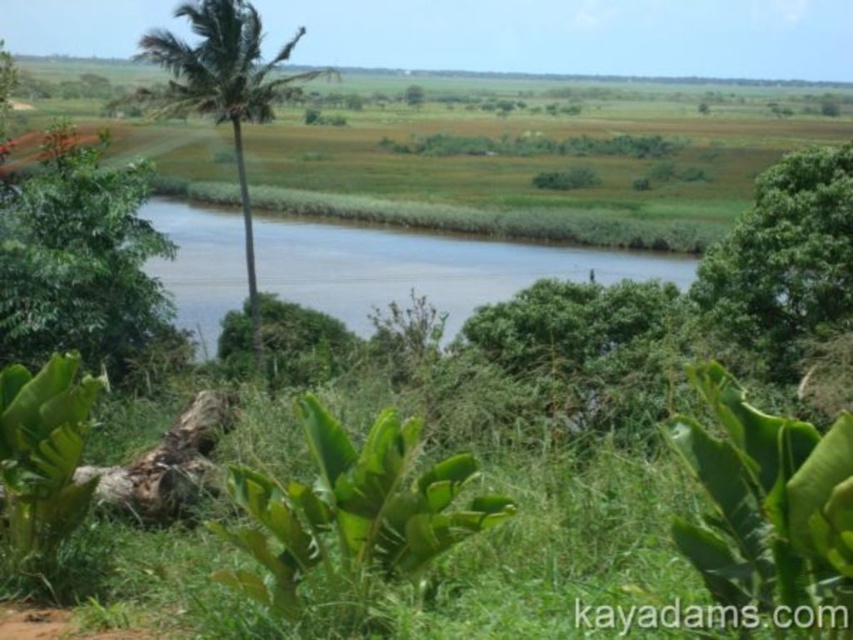
Question: Can you confirm if green leafy tree at left is positioned to the left of green leafy palm tree at left?

Choices:
 (A) yes
 (B) no

Answer: (B)

Question: Does green leafy tree at left have a greater width compared to green leafy palm tree at left?

Choices:
 (A) no
 (B) yes

Answer: (A)

Question: Which object appears closest to the camera in this image?

Choices:
 (A) green leafy tree at left
 (B) green leafy palm tree at left

Answer: (A)

Question: Is green leafy tree at left thinner than green leafy palm tree at left?

Choices:
 (A) yes
 (B) no

Answer: (A)